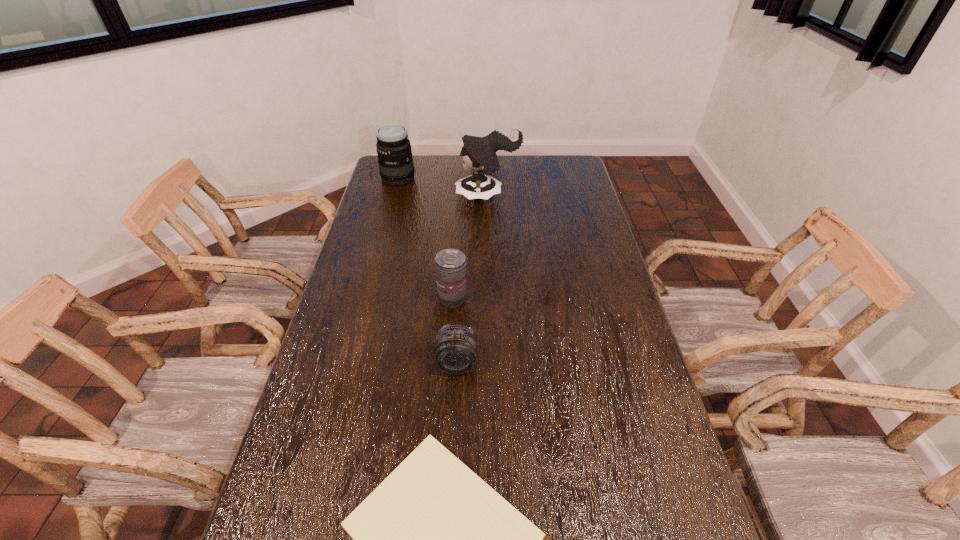
Locate an element on the screen. The width and height of the screenshot is (960, 540). the tallest object is located at coordinates (479, 155).

The height and width of the screenshot is (540, 960). What are the coordinates of `the leftmost telephoto lens` in the screenshot? It's located at (396, 167).

Identify the location of the farthest telephoto lens. The width and height of the screenshot is (960, 540). (396, 167).

At what (x,y) coordinates should I click in order to perform the action: click on the second shortest telephoto lens. Please return your answer as a coordinate pair (x, y). Looking at the image, I should click on (450, 264).

You are a GUI agent. You are given a task and a screenshot of the screen. Output one action in this format:
    pyautogui.click(x=<x>, y=<y>)
    Task: Click on the third shortest object
    
    Given the screenshot: What is the action you would take?
    pyautogui.click(x=450, y=264)

Locate an element on the screen. the shortest telephoto lens is located at coordinates (455, 348).

The width and height of the screenshot is (960, 540). Identify the location of the fourth farthest object. (455, 348).

Locate an element on the screen. vacant space located 0.100m at the face of the tallest object is located at coordinates (432, 196).

You are a GUI agent. You are given a task and a screenshot of the screen. Output one action in this format:
    pyautogui.click(x=<x>, y=<y>)
    Task: Click on the free space located at the face of the tallest object
    The image size is (960, 540).
    Given the screenshot: What is the action you would take?
    pyautogui.click(x=372, y=196)

Identify the location of vacant space located 0.330m at the face of the tallest object. coord(377,196).